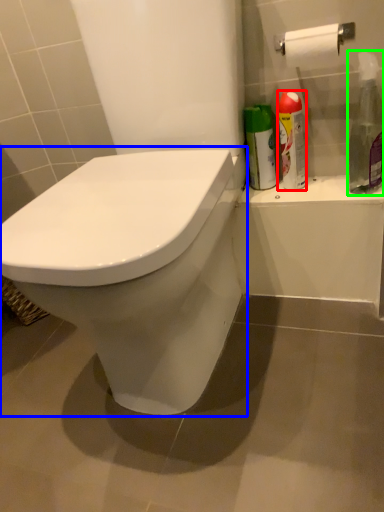
Question: Which is nearer to the cleaning product (highlighted by a red box)? toilet (highlighted by a blue box) or cleaning product (highlighted by a green box).

Choices:
 (A) toilet
 (B) cleaning product

Answer: (B)